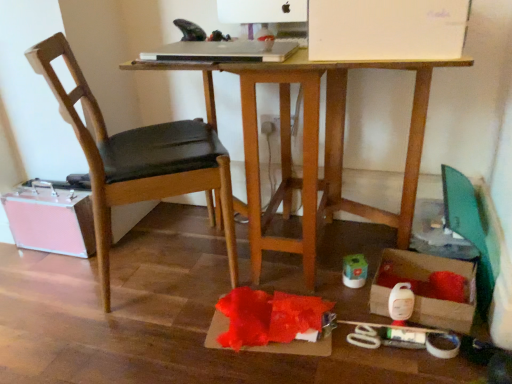
Question: Based on their sizes in the image, would you say pink metallic suitcase at lower left, which is the first storage box in left-to-right order, is bigger or smaller than wooden desk at center?

Choices:
 (A) big
 (B) small

Answer: (B)

Question: Would you say pink metallic suitcase at lower left, the first storage box from the back, is inside or outside wooden desk at center?

Choices:
 (A) inside
 (B) outside

Answer: (B)

Question: Which of these objects is positioned closest to the cardboard box at lower right, which ranks as the 2th storage box in back-to-front order?

Choices:
 (A) silver metallic laptop at upper center
 (B) wooden desk at center
 (C) matte white power plugs and sockets at center
 (D) pink metallic suitcase at lower left, placed as the 2th storage box when sorted from right to left
 (E) black leather chair at left

Answer: (B)

Question: Estimate the real-world distances between objects in this image. Which object is closer to the matte white power plugs and sockets at center?

Choices:
 (A) silver metallic laptop at upper center
 (B) cardboard box at lower right, which ranks as the 2th storage box in back-to-front order
 (C) wooden desk at center
 (D) black leather chair at left
 (E) pink metallic suitcase at lower left, the first storage box from the back

Answer: (C)